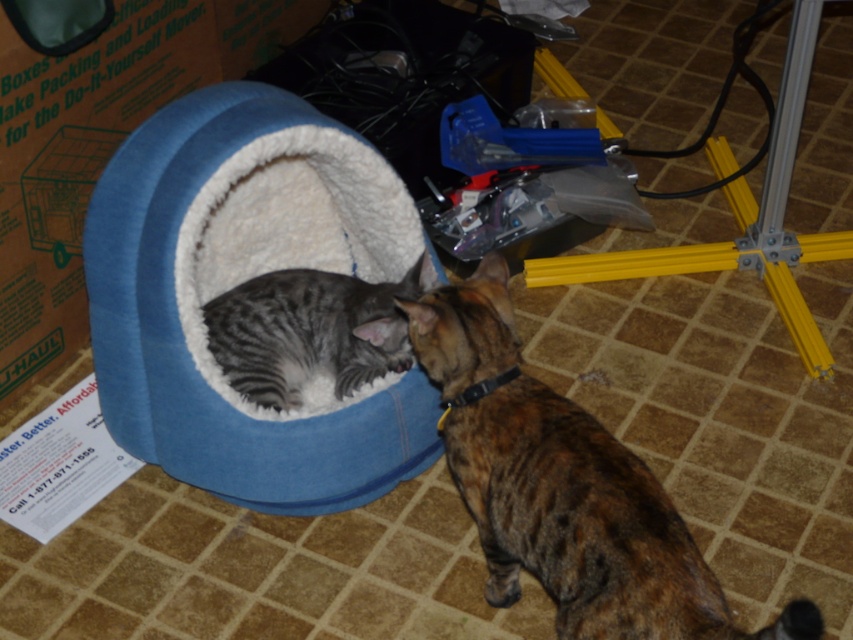
Question: Considering the real-world distances, which object is closest to the gray striped cat at center?

Choices:
 (A) blue plush cat bed at center
 (B) brown textured fur cat at center

Answer: (A)

Question: Is blue plush cat bed at center positioned before gray striped cat at center?

Choices:
 (A) yes
 (B) no

Answer: (A)

Question: Does blue plush cat bed at center have a lesser width compared to gray striped cat at center?

Choices:
 (A) yes
 (B) no

Answer: (B)

Question: Which point is farther to the camera?

Choices:
 (A) blue plush cat bed at center
 (B) gray striped cat at center

Answer: (B)

Question: Can you confirm if brown textured fur cat at center is positioned to the left of gray striped cat at center?

Choices:
 (A) yes
 (B) no

Answer: (B)

Question: Among these points, which one is farthest from the camera?

Choices:
 (A) (270, 374)
 (B) (328, 420)

Answer: (A)